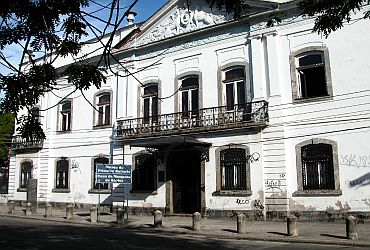
Locate an element on the screen. The image size is (370, 250). 1 entrance is located at coordinates (181, 185).